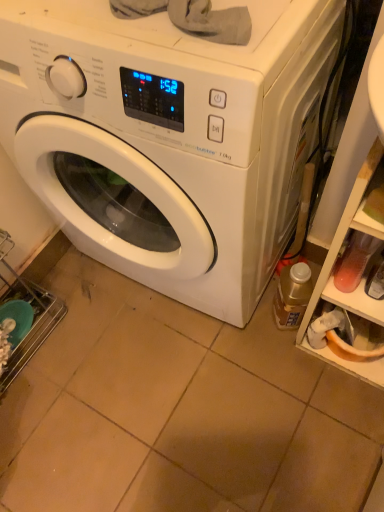
Question: Is white glossy washing machine at center outside of translucent plastic bottle at lower right?

Choices:
 (A) no
 (B) yes

Answer: (B)

Question: Is white glossy washing machine at center far from translucent plastic bottle at lower right?

Choices:
 (A) yes
 (B) no

Answer: (B)

Question: Is white glossy washing machine at center beside translucent plastic bottle at lower right?

Choices:
 (A) no
 (B) yes

Answer: (A)

Question: Considering the relative sizes of white glossy washing machine at center and translucent plastic bottle at lower right in the image provided, is white glossy washing machine at center taller than translucent plastic bottle at lower right?

Choices:
 (A) yes
 (B) no

Answer: (A)

Question: From a real-world perspective, does white glossy washing machine at center sit lower than translucent plastic bottle at lower right?

Choices:
 (A) no
 (B) yes

Answer: (A)

Question: Relative to translucent plastic shelf at right, is translucent plastic bottle at lower right in front or behind?

Choices:
 (A) behind
 (B) front

Answer: (A)

Question: From the image's perspective, is translucent plastic bottle at lower right located above or below translucent plastic shelf at right?

Choices:
 (A) below
 (B) above

Answer: (A)

Question: Based on their sizes in the image, would you say translucent plastic bottle at lower right is bigger or smaller than translucent plastic shelf at right?

Choices:
 (A) big
 (B) small

Answer: (B)

Question: Considering the positions of translucent plastic bottle at lower right and translucent plastic shelf at right in the image, is translucent plastic bottle at lower right taller or shorter than translucent plastic shelf at right?

Choices:
 (A) tall
 (B) short

Answer: (B)

Question: In terms of size, does white glossy washing machine at center appear bigger or smaller than translucent plastic shelf at right?

Choices:
 (A) big
 (B) small

Answer: (A)

Question: Looking at their shapes, would you say white glossy washing machine at center is wider or thinner than translucent plastic shelf at right?

Choices:
 (A) thin
 (B) wide

Answer: (B)

Question: Considering their positions, is white glossy washing machine at center located in front of or behind translucent plastic shelf at right?

Choices:
 (A) front
 (B) behind

Answer: (A)

Question: Do you think white glossy washing machine at center is within translucent plastic shelf at right, or outside of it?

Choices:
 (A) outside
 (B) inside

Answer: (A)

Question: Does point (168, 130) appear closer or farther from the camera than point (292, 285)?

Choices:
 (A) farther
 (B) closer

Answer: (B)

Question: Would you say white glossy washing machine at center is to the left or to the right of translucent plastic bottle at lower right in the picture?

Choices:
 (A) left
 (B) right

Answer: (A)